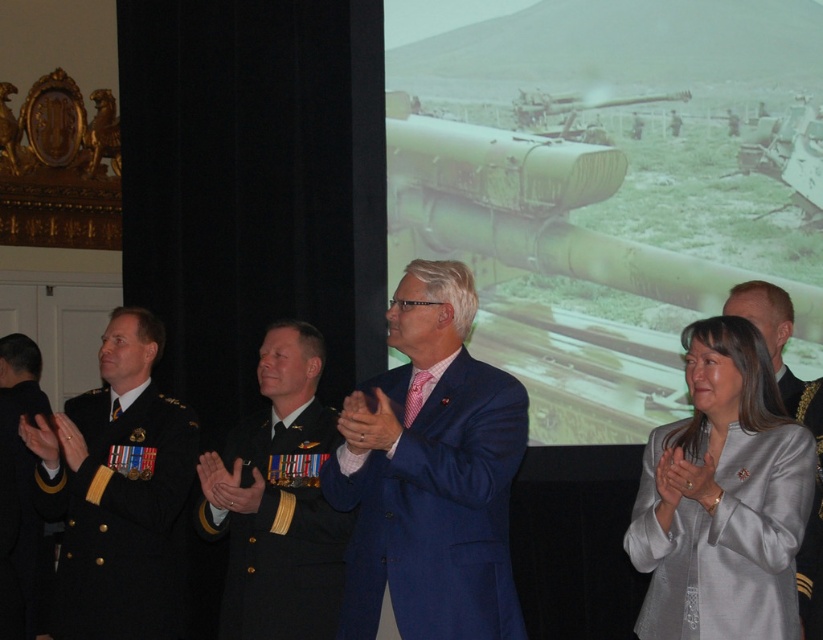
Between point (515, 444) and point (12, 582), which one is positioned in front?

Point (515, 444)

Can you confirm if blue satin suit at center is positioned to the right of black wool military uniform at left?

Indeed, blue satin suit at center is positioned on the right side of black wool military uniform at left.

This screenshot has width=823, height=640. What do you see at coordinates (435, 508) in the screenshot?
I see `blue satin suit at center` at bounding box center [435, 508].

Find the location of a particular element. The width and height of the screenshot is (823, 640). blue satin suit at center is located at coordinates (435, 508).

Can you confirm if dark blue fabric uniform at center is shorter than light brown uniform at center?

No, dark blue fabric uniform at center is not shorter than light brown uniform at center.

Between point (252, 433) and point (737, 294), which one is positioned behind?

Point (252, 433)

Where is `dark blue fabric uniform at center`? The image size is (823, 640). dark blue fabric uniform at center is located at coordinates (281, 531).

Between silver satin blazer at lower right and navy blue fabric uniform at left, which one is positioned higher?

silver satin blazer at lower right

Can you confirm if silver satin blazer at lower right is bigger than navy blue fabric uniform at left?

Actually, silver satin blazer at lower right might be smaller than navy blue fabric uniform at left.

Where is `silver satin blazer at lower right`? The height and width of the screenshot is (640, 823). silver satin blazer at lower right is located at coordinates (723, 497).